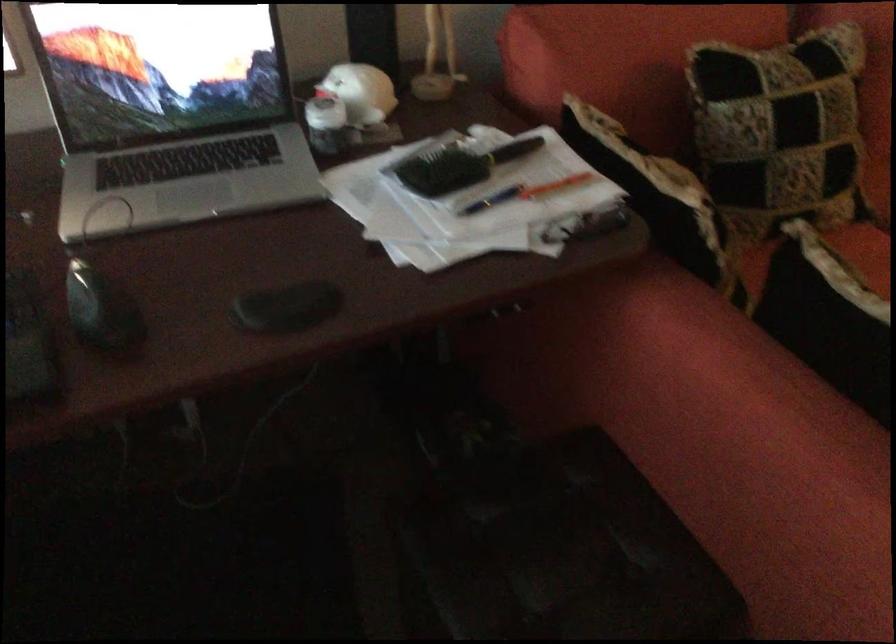
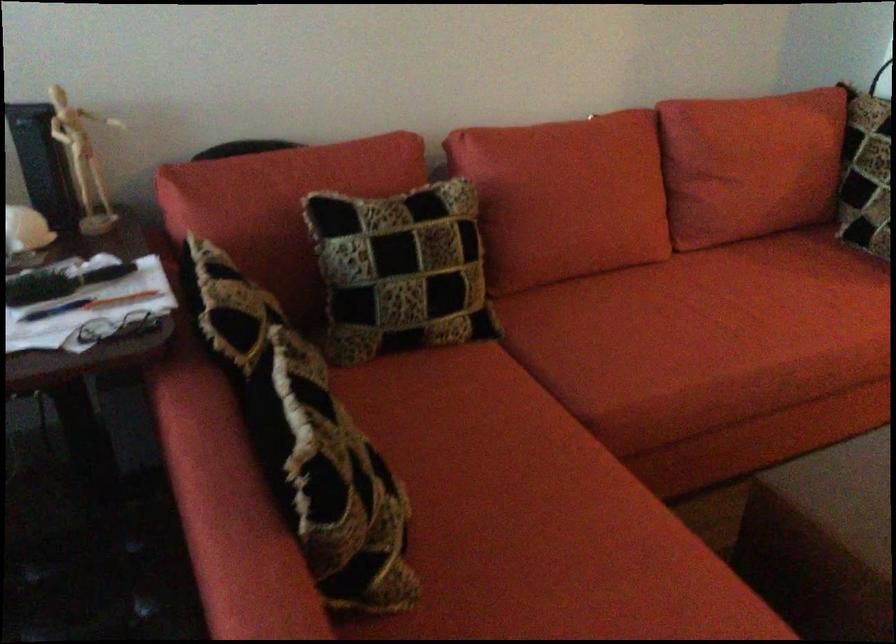
Question: Based on the continuous images, in which direction is the camera rotating? Reply with the corresponding letter.

Choices:
 (A) Left
 (B) Right
 (C) Up
 (D) Down

Answer: (C)